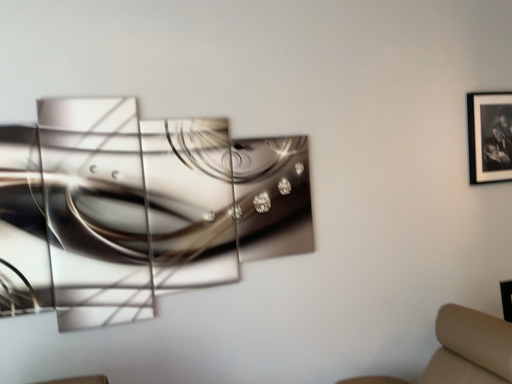
Question: Should I look upward or downward to see black matte picture frame at upper right?

Choices:
 (A) down
 (B) up

Answer: (B)